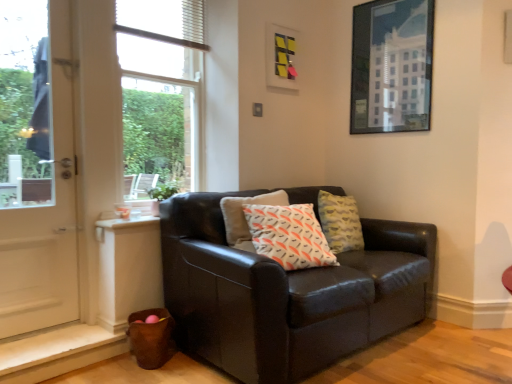
Question: From the image's perspective, is metallic glass picture frame at upper right, marked as the second picture frame in a left-to-right arrangement, beneath white glossy door at left?

Choices:
 (A) yes
 (B) no

Answer: (B)

Question: Is metallic glass picture frame at upper right, the first picture frame in the right-to-left sequence, wider than white glossy door at left?

Choices:
 (A) no
 (B) yes

Answer: (A)

Question: From a real-world perspective, is metallic glass picture frame at upper right, the first picture frame in the right-to-left sequence, located beneath white glossy door at left?

Choices:
 (A) no
 (B) yes

Answer: (A)

Question: Could you tell me if metallic glass picture frame at upper right, the first picture frame in the right-to-left sequence, is facing white glossy door at left?

Choices:
 (A) yes
 (B) no

Answer: (A)

Question: Visually, is white glossy door at left positioned to the left or to the right of clear glass window at upper left?

Choices:
 (A) right
 (B) left

Answer: (B)

Question: Considering their positions, is white glossy door at left located in front of or behind clear glass window at upper left?

Choices:
 (A) behind
 (B) front

Answer: (B)

Question: Looking at their shapes, would you say white glossy door at left is wider or thinner than clear glass window at upper left?

Choices:
 (A) thin
 (B) wide

Answer: (B)

Question: From the image's perspective, relative to clear glass window at upper left, is white glossy door at left above or below?

Choices:
 (A) above
 (B) below

Answer: (B)

Question: Looking at their shapes, would you say white textured blind at upper center is wider or thinner than clear glass window at upper left?

Choices:
 (A) wide
 (B) thin

Answer: (B)

Question: Is white textured blind at upper center inside the boundaries of clear glass window at upper left, or outside?

Choices:
 (A) inside
 (B) outside

Answer: (A)

Question: From the image's perspective, is white textured blind at upper center above or below clear glass window at upper left?

Choices:
 (A) above
 (B) below

Answer: (A)

Question: Is white textured blind at upper center in front of or behind clear glass window at upper left in the image?

Choices:
 (A) behind
 (B) front

Answer: (A)

Question: Considering their positions, is metallic glass picture frame at upper right, the first picture frame in the right-to-left sequence, located in front of or behind white glossy door at left?

Choices:
 (A) behind
 (B) front

Answer: (A)

Question: Is metallic glass picture frame at upper right, the first picture frame in the right-to-left sequence, situated inside white glossy door at left or outside?

Choices:
 (A) inside
 (B) outside

Answer: (B)